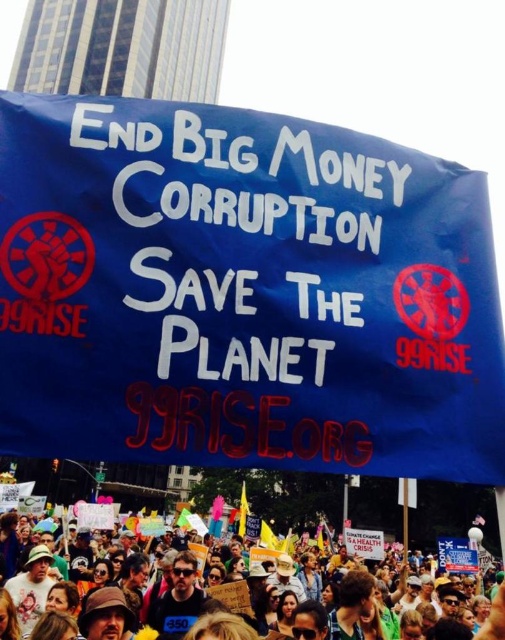
Question: Does blue fabric banner at center have a smaller size compared to blue fabric crowd at lower center?

Choices:
 (A) yes
 (B) no

Answer: (A)

Question: Among these objects, which one is nearest to the camera?

Choices:
 (A) blue fabric banner at center
 (B) blue fabric crowd at lower center

Answer: (B)

Question: Is blue fabric banner at center in front of blue fabric crowd at lower center?

Choices:
 (A) yes
 (B) no

Answer: (B)

Question: Does blue fabric banner at center appear under blue fabric crowd at lower center?

Choices:
 (A) yes
 (B) no

Answer: (B)

Question: Which of the following is the farthest from the observer?

Choices:
 (A) (348, 612)
 (B) (20, 214)

Answer: (A)